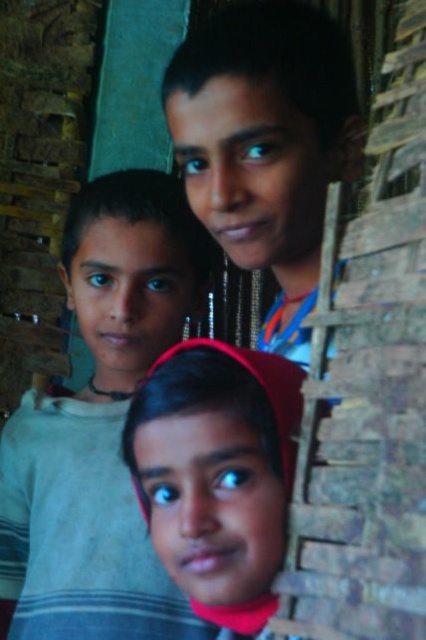
Question: Is smooth skin face at center positioned in front of pink fabric headscarf at center?

Choices:
 (A) no
 (B) yes

Answer: (A)

Question: Is smooth skin face at center to the left of pink fabric headscarf at center from the viewer's perspective?

Choices:
 (A) yes
 (B) no

Answer: (B)

Question: Which point is farther from the camera taking this photo?

Choices:
 (A) (324, 68)
 (B) (66, 248)
 (C) (290, 419)

Answer: (B)

Question: Estimate the real-world distances between objects in this image. Which object is closer to the pink fabric headscarf at center?

Choices:
 (A) light gray striped shirt at center
 (B) smooth skin face at center

Answer: (B)

Question: Estimate the real-world distances between objects in this image. Which object is farther from the smooth skin face at center?

Choices:
 (A) light gray striped shirt at center
 (B) pink fabric headscarf at center

Answer: (A)

Question: Does light gray striped shirt at center have a greater width compared to smooth skin face at center?

Choices:
 (A) yes
 (B) no

Answer: (A)